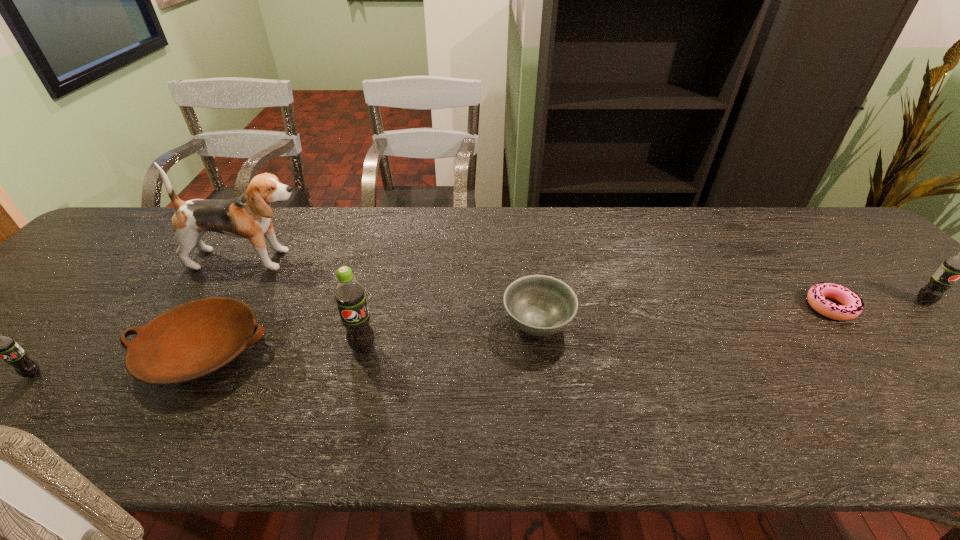
At what (x,y) coordinates should I click in order to perform the action: click on the closest soda to the doughnut. Please return your answer as a coordinate pair (x, y). Looking at the image, I should click on (959, 266).

This screenshot has width=960, height=540. Find the location of `free spot that satisfies the following two spatial constraints: 1. at the face of the puppy; 2. on the right side of the third object from right to left`. free spot that satisfies the following two spatial constraints: 1. at the face of the puppy; 2. on the right side of the third object from right to left is located at coordinates (212, 323).

Locate an element on the screen. This screenshot has height=540, width=960. free space that satisfies the following two spatial constraints: 1. at the face of the doughnut; 2. on the left side of the farthest object is located at coordinates (223, 307).

This screenshot has height=540, width=960. Identify the location of blank area in the image that satisfies the following two spatial constraints: 1. at the face of the tallest object; 2. on the front label of the leftmost soda. (181, 374).